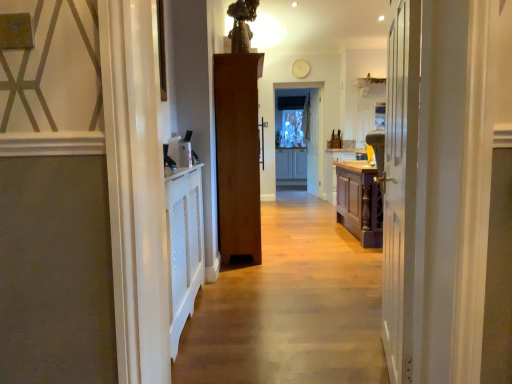
Find the location of a particular element. The width and height of the screenshot is (512, 384). white wooden door at center, which is counted as the second door, starting from the left is located at coordinates tap(400, 188).

At what (x,y) coordinates should I click in order to perform the action: click on white wooden door at center, the 1th door viewed from the right. Please return your answer as a coordinate pair (x, y). Image resolution: width=512 pixels, height=384 pixels. Looking at the image, I should click on (312, 141).

What is the approximate height of white wooden door at center, the 3th door when ordered from front to back?

white wooden door at center, the 3th door when ordered from front to back, is 1.97 meters in height.

Where is `wooden cabinet at center`? Image resolution: width=512 pixels, height=384 pixels. wooden cabinet at center is located at coordinates (321, 71).

The width and height of the screenshot is (512, 384). What do you see at coordinates (321, 71) in the screenshot? I see `wooden cabinet at center` at bounding box center [321, 71].

This screenshot has height=384, width=512. Find the location of `brown wooden door at center, acting as the 1th door starting from the left`. brown wooden door at center, acting as the 1th door starting from the left is located at coordinates (238, 156).

Considering the sizes of objects wooden cabinet at center and white wooden door at center, the second door in the right-to-left sequence, in the image provided, who is bigger, wooden cabinet at center or white wooden door at center, the second door in the right-to-left sequence,?

wooden cabinet at center.

Considering the positions of objects wooden cabinet at center and white wooden door at center, the second door in the right-to-left sequence, in the image provided, who is more to the left, wooden cabinet at center or white wooden door at center, the second door in the right-to-left sequence,?

From the viewer's perspective, wooden cabinet at center appears more on the left side.

Is wooden cabinet at center far away from white wooden door at center, acting as the first door starting from the front?

wooden cabinet at center is positioned a significant distance from white wooden door at center, acting as the first door starting from the front.

The height and width of the screenshot is (384, 512). What are the coordinates of `the 1st door behind the wooden cabinet at center, starting your count from the anchor` in the screenshot? It's located at (400, 188).

From the image's perspective, which one is positioned lower, clear glass screen door at center or wooden cabinet at center?

wooden cabinet at center.

Is clear glass screen door at center outside of wooden cabinet at center?

That's correct, clear glass screen door at center is outside of wooden cabinet at center.

Relative to wooden cabinet at center, is clear glass screen door at center in front or behind?

Clearly, clear glass screen door at center is behind wooden cabinet at center.

Which object is positioned more to the left, clear glass screen door at center or wooden cabinet at center?

wooden cabinet at center.

What's the angular difference between wooden floor at center and white wooden door at center, the 1th door viewed from the right,'s facing directions?

wooden floor at center and white wooden door at center, the 1th door viewed from the right, are facing 97.3 degrees away from each other.

Is wooden floor at center next to white wooden door at center, the 1th door viewed from the right?

No, wooden floor at center is not with white wooden door at center, the 1th door viewed from the right.

Considering the relative sizes of wooden floor at center and white wooden door at center, the 3th door when ordered from front to back, in the image provided, is wooden floor at center wider than white wooden door at center, the 3th door when ordered from front to back,?

Yes.

Is wooden floor at center shorter than white wooden door at center, the 3th door when ordered from front to back?

Yes, wooden floor at center is shorter than white wooden door at center, the 3th door when ordered from front to back.

Who is taller, wooden floor at center or brown wooden door at center, which is the 2th door from back to front?

With more height is brown wooden door at center, which is the 2th door from back to front.

Is wooden floor at center further to the viewer compared to brown wooden door at center, acting as the 1th door starting from the left?

No, wooden floor at center is in front of brown wooden door at center, acting as the 1th door starting from the left.

Is wooden floor at center to the left of brown wooden door at center, marked as the third door in a right-to-left arrangement, from the viewer's perspective?

Incorrect, wooden floor at center is not on the left side of brown wooden door at center, marked as the third door in a right-to-left arrangement.

Which of these two, wooden floor at center or brown wooden door at center, which is the 2th door from back to front, is smaller?

Smaller between the two is wooden floor at center.

Considering the sizes of objects white wooden door at center, the second door in the right-to-left sequence, and brown wooden door at center, positioned as the 2th door in front-to-back order, in the image provided, who is shorter, white wooden door at center, the second door in the right-to-left sequence, or brown wooden door at center, positioned as the 2th door in front-to-back order,?

With less height is white wooden door at center, the second door in the right-to-left sequence.

Which object is further away from the camera taking this photo, white wooden door at center, the second door in the right-to-left sequence, or brown wooden door at center, which is the 2th door from back to front?

brown wooden door at center, which is the 2th door from back to front, is further away from the camera.

Is brown wooden door at center, acting as the 1th door starting from the left, at the back of white wooden door at center, placed as the 3th door when sorted from back to front?

white wooden door at center, placed as the 3th door when sorted from back to front, does not have its back to brown wooden door at center, acting as the 1th door starting from the left.

In terms of width, does white wooden door at center, acting as the first door starting from the front, look wider or thinner when compared to brown wooden door at center, acting as the 1th door starting from the left?

Considering their sizes, white wooden door at center, acting as the first door starting from the front, looks slimmer than brown wooden door at center, acting as the 1th door starting from the left.

Is white wooden door at center, the 1th door viewed from the back, to the left of brown wooden door at center, marked as the third door in a right-to-left arrangement, from the viewer's perspective?

No, white wooden door at center, the 1th door viewed from the back, is not to the left of brown wooden door at center, marked as the third door in a right-to-left arrangement.

From a real-world perspective, is white wooden door at center, the 3th door when ordered from front to back, on top of brown wooden door at center, positioned as the 2th door in front-to-back order?

Yes, from a real-world perspective, white wooden door at center, the 3th door when ordered from front to back, is above brown wooden door at center, positioned as the 2th door in front-to-back order.

Measure the distance between white wooden door at center, the 3th door when ordered from front to back, and brown wooden door at center, positioned as the 2th door in front-to-back order.

4.00 meters.

Could you tell me if white wooden door at center, the third door from the left, is turned towards brown wooden door at center, which is the 2th door from back to front?

No, white wooden door at center, the third door from the left, is not turned towards brown wooden door at center, which is the 2th door from back to front.

Which point is more distant from viewer, (296,123) or (317,126)?

Point (296,123)

Based on their sizes in the image, would you say clear glass screen door at center is bigger or smaller than white wooden door at center, the third door from the left?

In the image, clear glass screen door at center appears to be smaller than white wooden door at center, the third door from the left.

In the scene shown: From the image's perspective, which one is positioned higher, clear glass screen door at center or white wooden door at center, the 1th door viewed from the back?

white wooden door at center, the 1th door viewed from the back, is shown above in the image.

You are a GUI agent. You are given a task and a screenshot of the screen. Output one action in this format:
    pyautogui.click(x=<x>, y=<y>)
    Task: Click on the screen door above the white wooden door at center, the third door from the left (from a real-world perspective)
    
    Given the screenshot: What is the action you would take?
    pyautogui.click(x=298, y=141)

This screenshot has width=512, height=384. I want to click on corridor in front of the white wooden door at center, placed as the 3th door when sorted from back to front, so click(x=321, y=71).

I want to click on screen door to the right of wooden cabinet at center, so click(298, 141).

Looking at the image, which one is located further to clear glass screen door at center, brown wooden door at center, positioned as the 2th door in front-to-back order, or wooden floor at center?

brown wooden door at center, positioned as the 2th door in front-to-back order, is positioned further to the anchor clear glass screen door at center.

From the image, which object appears to be farther from wooden cabinet at center, white wooden door at center, placed as the 3th door when sorted from back to front, or white wooden door at center, the third door from the left?

white wooden door at center, placed as the 3th door when sorted from back to front, lies further to wooden cabinet at center than the other object.

Estimate the real-world distances between objects in this image. Which object is further from brown wooden door at center, which is the 2th door from back to front, wooden cabinet at center or white wooden door at center, placed as the 3th door when sorted from back to front?

wooden cabinet at center is positioned further to the anchor brown wooden door at center, which is the 2th door from back to front.

In the scene shown: From the image, which object appears to be farther from white wooden door at center, placed as the 3th door when sorted from back to front, clear glass screen door at center or white wooden door at center, the 3th door when ordered from front to back?

Among the two, white wooden door at center, the 3th door when ordered from front to back, is located further to white wooden door at center, placed as the 3th door when sorted from back to front.

From the image, which object appears to be nearer to brown wooden door at center, which is the 2th door from back to front, white wooden door at center, the second door in the right-to-left sequence, or wooden cabinet at center?

white wooden door at center, the second door in the right-to-left sequence, lies closer to brown wooden door at center, which is the 2th door from back to front, than the other object.

When comparing their distances from wooden floor at center, does white wooden door at center, the second door in the right-to-left sequence, or brown wooden door at center, acting as the 1th door starting from the left, seem further?

brown wooden door at center, acting as the 1th door starting from the left, is further to wooden floor at center.

Based on their spatial positions, is white wooden door at center, placed as the 3th door when sorted from back to front, or wooden cabinet at center closer to white wooden door at center, the 1th door viewed from the right?

Based on the image, wooden cabinet at center appears to be nearer to white wooden door at center, the 1th door viewed from the right.

From the image, which object appears to be farther from white wooden door at center, the third door from the left, brown wooden door at center, acting as the 1th door starting from the left, or wooden cabinet at center?

brown wooden door at center, acting as the 1th door starting from the left, lies further to white wooden door at center, the third door from the left, than the other object.

This screenshot has width=512, height=384. I want to click on path positioned between wooden cabinet at center and white wooden door at center, the 3th door when ordered from front to back, from near to far, so click(x=290, y=307).

The height and width of the screenshot is (384, 512). I want to click on door located between wooden cabinet at center and brown wooden door at center, which is the 2th door from back to front, in the depth direction, so click(400, 188).

I want to click on door between wooden cabinet at center and wooden floor at center in the front-back direction, so click(x=400, y=188).

What are the coordinates of `path between white wooden door at center, acting as the first door starting from the front, and white wooden door at center, the third door from the left, along the z-axis` in the screenshot? It's located at (290, 307).